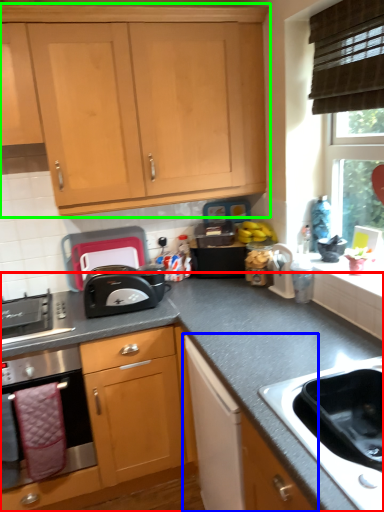
Question: Which object is the farthest from countertop (highlighted by a red box)? Choose among these: cabinetry (highlighted by a blue box) or cabinetry (highlighted by a green box).

Choices:
 (A) cabinetry
 (B) cabinetry

Answer: (B)